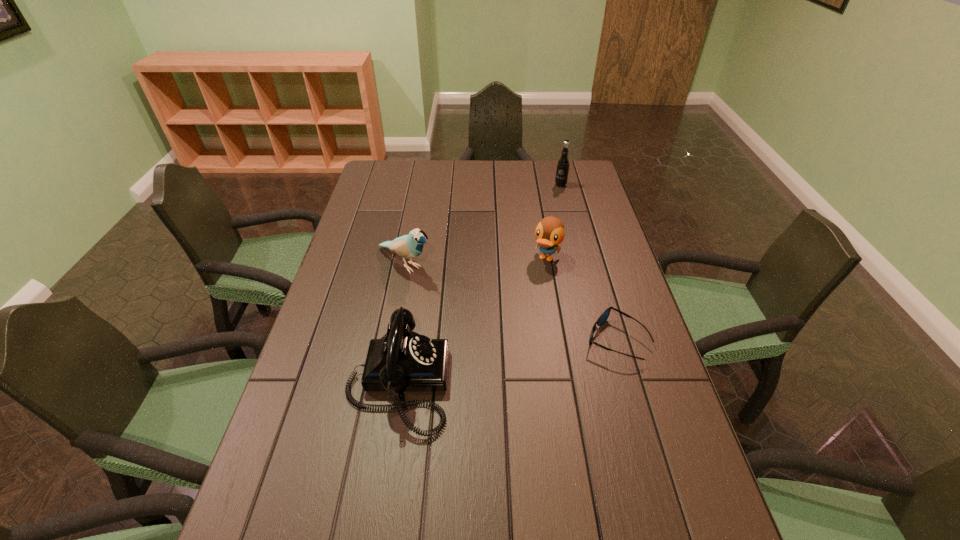
This screenshot has width=960, height=540. In order to click on telephone in this screenshot , I will do `click(402, 360)`.

Find the location of `sunglasses`. sunglasses is located at coordinates (603, 317).

At what (x,y) coordinates should I click in order to perform the action: click on bird. Please return your answer as a coordinate pair (x, y). Image resolution: width=960 pixels, height=540 pixels. Looking at the image, I should click on (409, 246).

The width and height of the screenshot is (960, 540). I want to click on the third object from left to right, so click(x=550, y=232).

The height and width of the screenshot is (540, 960). I want to click on root beer, so click(563, 163).

Where is `vacant region located on the dial of the telephone`? The width and height of the screenshot is (960, 540). vacant region located on the dial of the telephone is located at coordinates (562, 382).

The height and width of the screenshot is (540, 960). Identify the location of vacant region located at the front of the sunglasses showing the lenses. (551, 340).

This screenshot has width=960, height=540. In order to click on free space located at the front of the sunglasses showing the lenses in this screenshot , I will do `click(503, 340)`.

Where is `free space located at the front of the sunglasses showing the lenses`? This screenshot has width=960, height=540. free space located at the front of the sunglasses showing the lenses is located at coordinates (551, 340).

Where is `free region located at the face of the bird`? The height and width of the screenshot is (540, 960). free region located at the face of the bird is located at coordinates (452, 293).